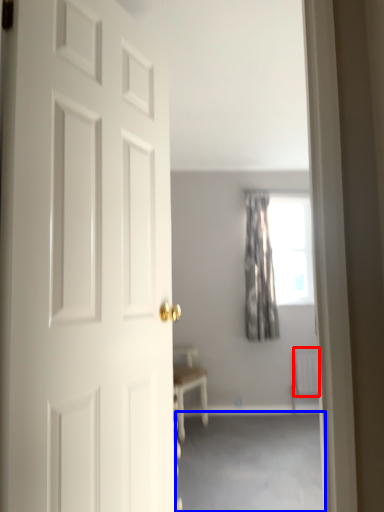
Question: Which object appears farthest to the camera in this image, radiator (highlighted by a red box) or corridor (highlighted by a blue box)?

Choices:
 (A) radiator
 (B) corridor

Answer: (A)